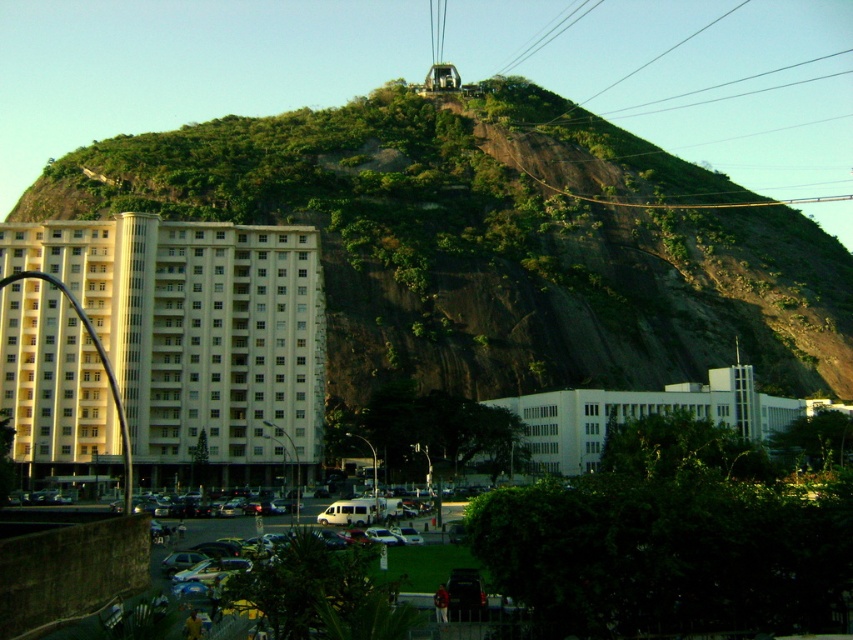
You are standing in the city park and want to take a photo of the beige concrete building at left and the metallic cable car at upper center. Which object should you zoom in more on to capture both in the frame without cropping?

You should zoom in more on the beige concrete building at left because it is smaller than the metallic cable car at upper center, so adjusting focus to include the smaller object while keeping the larger one in view requires a balanced zoom.

You are standing at the base of the hill and looking towards the building. Which object is closer to you, the metallic cable car at upper center or the white smooth building at center?

The metallic cable car at upper center is closer to you because the white smooth building at center is behind it.